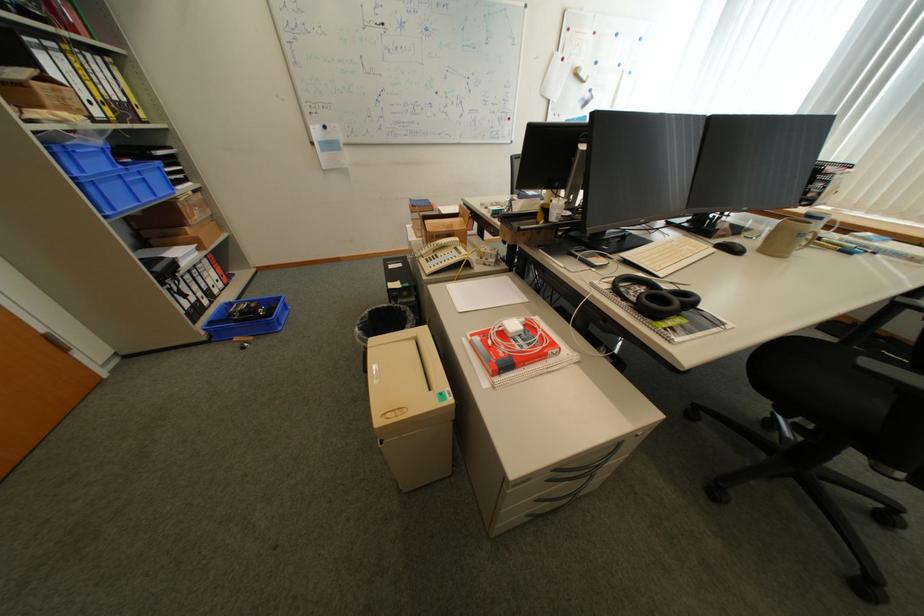
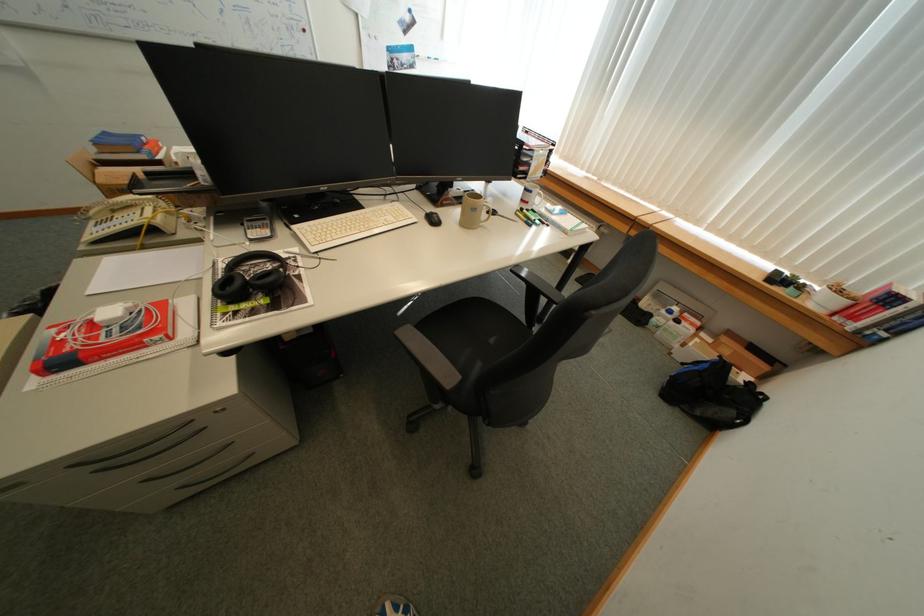
Where in the second image is the point corresponding to point (810, 237) from the first image?

(483, 209)